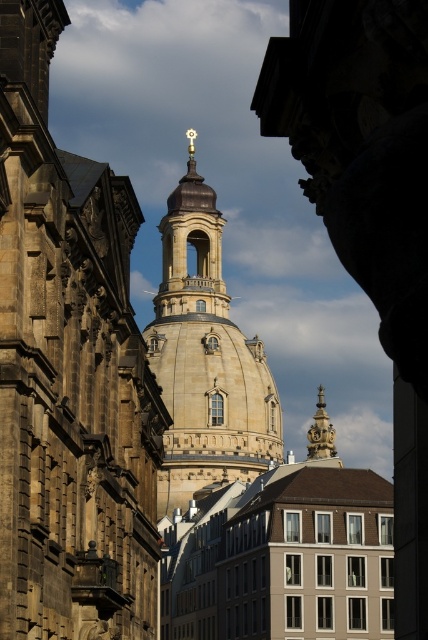
Based on the photo, between stone church at center and stone tower at center, which one appears on the right side from the viewer's perspective?

stone tower at center is more to the right.

Which is more to the left, stone church at center or stone tower at center?

From the viewer's perspective, stone church at center appears more on the left side.

Is point (146, 452) positioned after point (174, 497)?

No, (146, 452) is in front of (174, 497).

Identify the location of stone church at center. (68, 372).